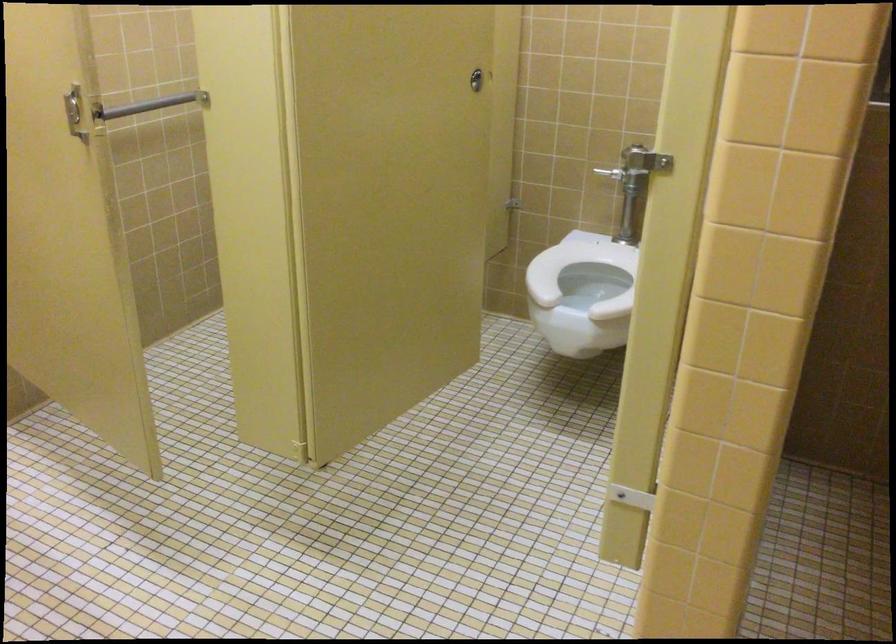
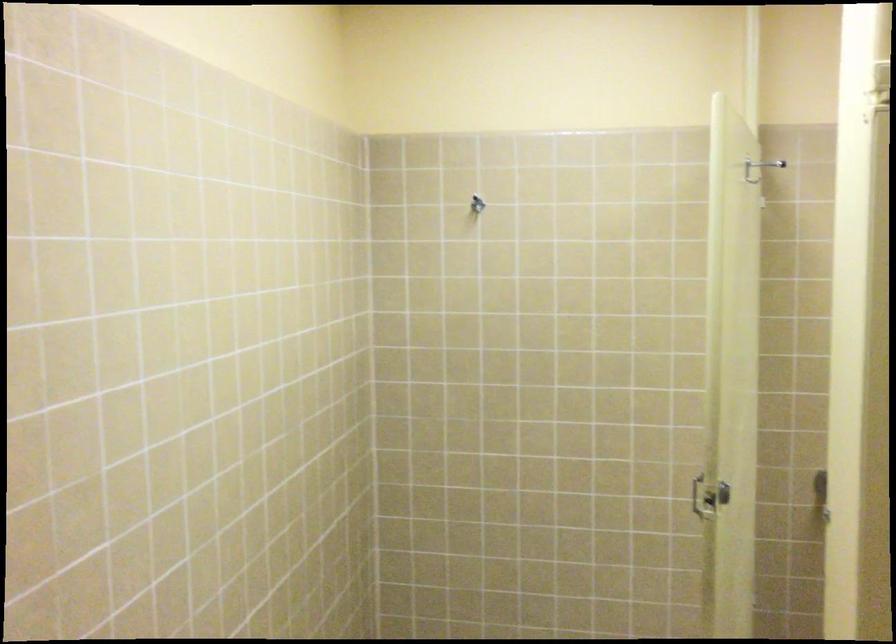
Question: How did the camera likely rotate?

Choices:
 (A) Left
 (B) Right
 (C) Up
 (D) Down

Answer: (A)